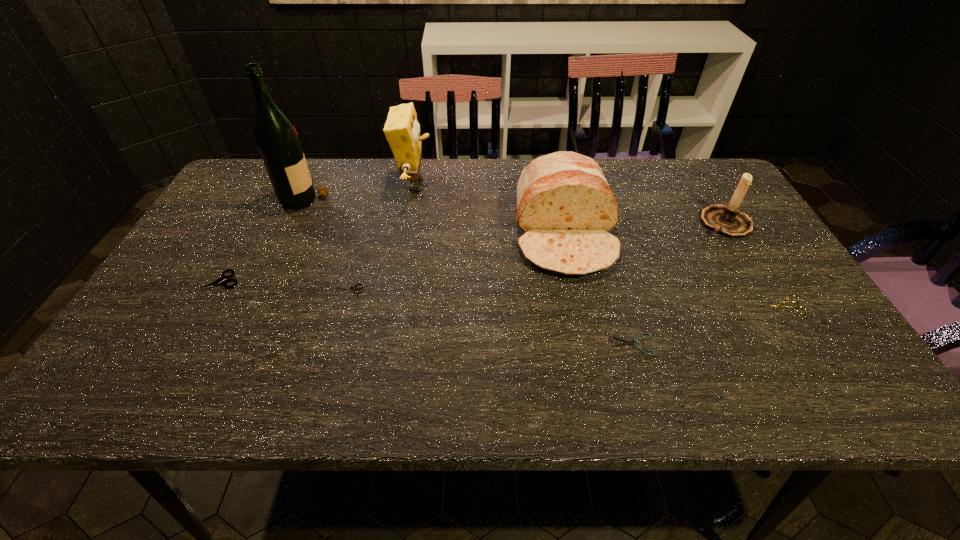
Find the location of `the shortest shears`. the shortest shears is located at coordinates (640, 348).

Where is `the shortest object`? This screenshot has width=960, height=540. the shortest object is located at coordinates (640, 348).

Where is `vacant space located on the left of the tallest object`? vacant space located on the left of the tallest object is located at coordinates (229, 195).

Where is `vacant region located on the face of the sponge`? Image resolution: width=960 pixels, height=540 pixels. vacant region located on the face of the sponge is located at coordinates (486, 185).

Locate an element on the screen. The image size is (960, 540). free space located 0.250m on the back of the candle holder is located at coordinates (687, 161).

Find the location of a particular element. This screenshot has height=540, width=960. vacant space situated 0.090m at the sliced end of the bread is located at coordinates coord(580,310).

Find the location of `vacant space situated on the front of the fifth tallest object`. vacant space situated on the front of the fifth tallest object is located at coordinates (182, 348).

You are a GUI agent. You are given a task and a screenshot of the screen. Output one action in this format:
    pyautogui.click(x=<x>, y=<y>)
    Task: Click on the vacant area situated on the front of the second nearest shears
    
    Given the screenshot: What is the action you would take?
    click(807, 353)

Identify the location of vacant region located on the back of the sixth object from right to left. This screenshot has width=960, height=540. (364, 224).

You are a GUI agent. You are given a task and a screenshot of the screen. Output one action in this format:
    pyautogui.click(x=<x>, y=<y>)
    Task: Click on the free region located 0.120m on the left of the nearest shears
    Image resolution: width=960 pixels, height=540 pixels.
    Given the screenshot: What is the action you would take?
    pyautogui.click(x=555, y=345)